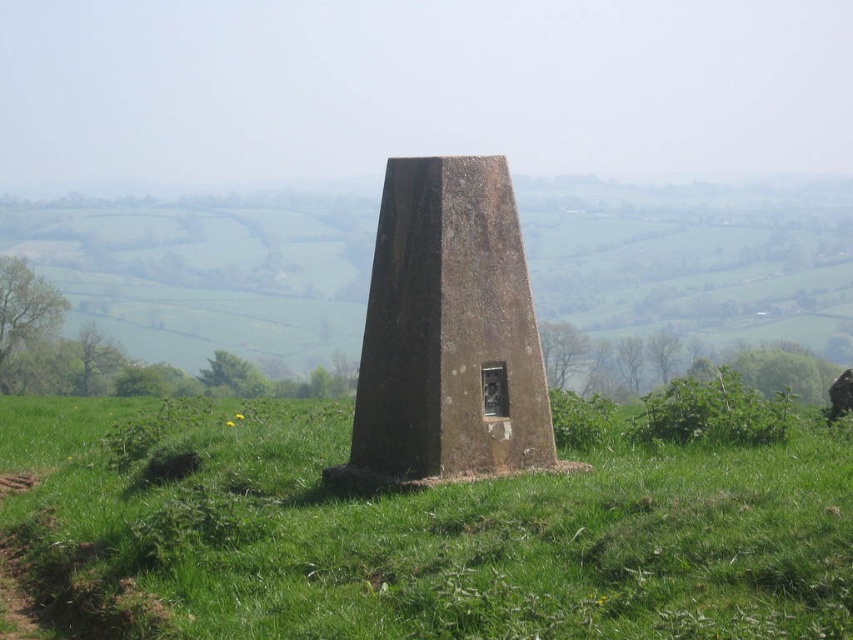
You are standing in the field and want to take a photo of the brown stone monument at center. However, there is green grassy at center in the way. Can you see the monument clearly through the grass?

The green grassy at center is closer to the viewer than the brown stone monument at center, so the grass would block the view of the monument.

From the picture: You are standing in a field and see the green grassy at center and the brown stone monument at center. Which object is located to the left of the other?

The green grassy at center is positioned on the left side of brown stone monument at center.

You are standing in the grassy field looking at the triangular stone monument. There are two points marked on the monument. Which point, point [416,540] or point [503,433], is closer to you?

Point [416,540] is closer to you than point [503,433].